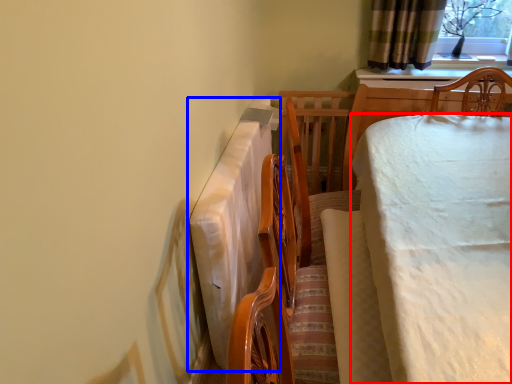
Question: Which object appears farthest to the camera in this image, table (highlighted by a red box) or tablecloth (highlighted by a blue box)?

Choices:
 (A) table
 (B) tablecloth

Answer: (B)